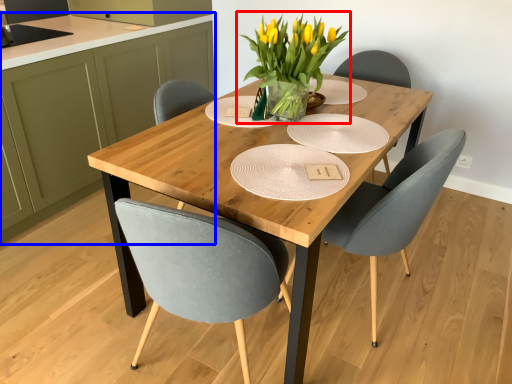
Question: Which point is further to the camera, houseplant (highlighted by a red box) or cabinetry (highlighted by a blue box)?

Choices:
 (A) houseplant
 (B) cabinetry

Answer: (B)